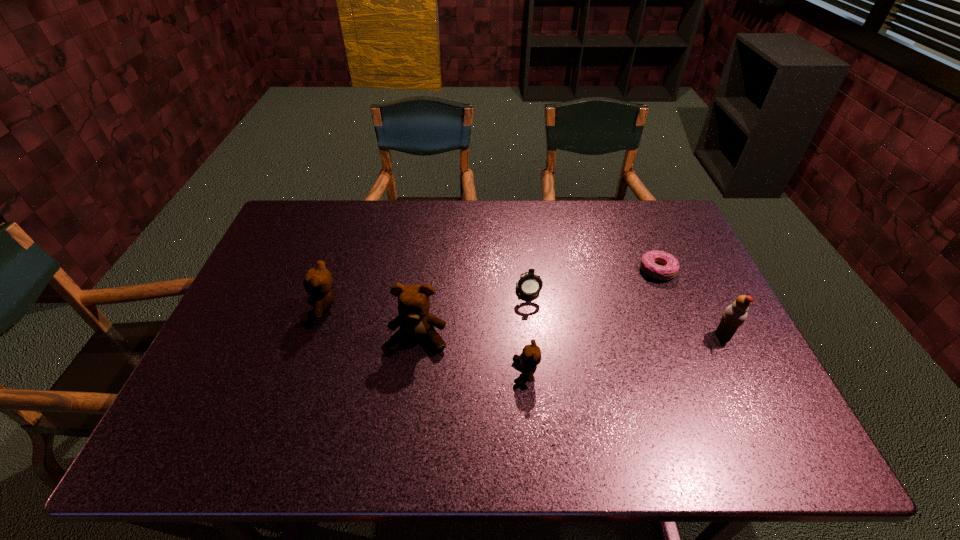
This screenshot has width=960, height=540. In order to click on the second shortest teddy bear in this screenshot , I will do `click(318, 281)`.

The image size is (960, 540). Find the location of `the leftmost object`. the leftmost object is located at coordinates (318, 281).

Locate an element on the screen. The image size is (960, 540). the fifth object from right to left is located at coordinates (415, 321).

The image size is (960, 540). Find the location of `the rightmost teddy bear`. the rightmost teddy bear is located at coordinates (530, 357).

Find the location of `the nearest object`. the nearest object is located at coordinates (530, 357).

The height and width of the screenshot is (540, 960). Identify the location of icecream. (734, 315).

Find the location of `compass`. compass is located at coordinates (529, 285).

The image size is (960, 540). Find the location of `the fifth object from left to right`. the fifth object from left to right is located at coordinates (669, 270).

At what (x,y) coordinates should I click in order to perform the action: click on the shortest object. Please return your answer as a coordinate pair (x, y). The image size is (960, 540). Looking at the image, I should click on (669, 270).

Locate an element on the screen. vacant space located on the front-facing side of the second shortest teddy bear is located at coordinates (255, 308).